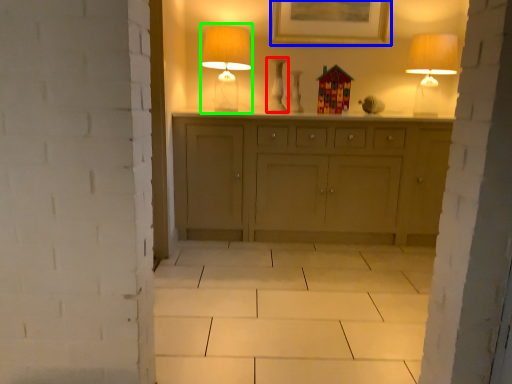
Question: Estimate the real-world distances between objects in this image. Which object is farther from vase (highlighted by a red box), picture frame (highlighted by a blue box) or table lamp (highlighted by a green box)?

Choices:
 (A) picture frame
 (B) table lamp

Answer: (A)